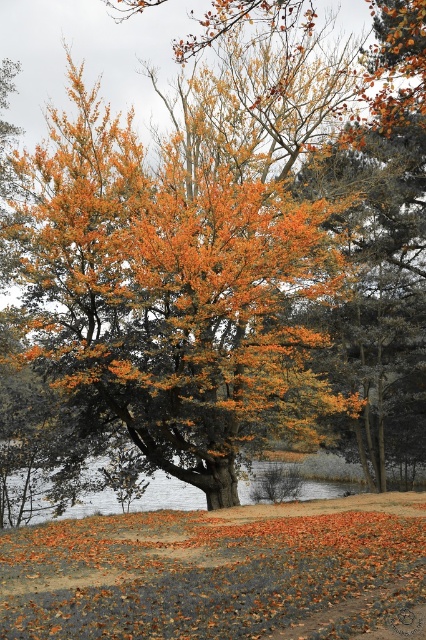
Question: Which of the following is the closest to the observer?

Choices:
 (A) (43, 275)
 (B) (425, 614)

Answer: (B)

Question: Is orange leafy tree at center below orange leaf litter at lower center?

Choices:
 (A) no
 (B) yes

Answer: (A)

Question: Which object is positioned farthest from the smooth gray water at lower center?

Choices:
 (A) orange leaf litter at lower center
 (B) orange leafy tree at center

Answer: (A)

Question: Is orange leafy tree at center closer to the viewer compared to smooth gray water at lower center?

Choices:
 (A) yes
 (B) no

Answer: (A)

Question: Which point appears closest to the camera in this image?

Choices:
 (A) (273, 374)
 (B) (279, 586)

Answer: (B)

Question: Is orange leafy tree at center further to the viewer compared to orange leaf litter at lower center?

Choices:
 (A) yes
 (B) no

Answer: (A)